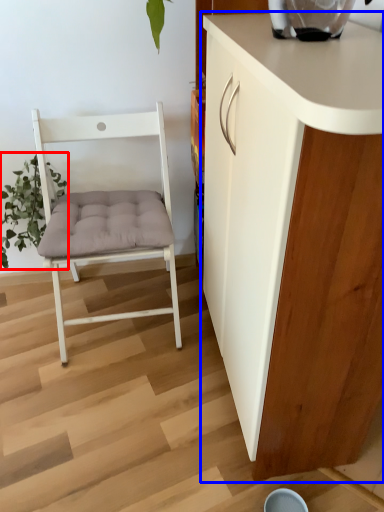
Question: Which of the following is the closest to the observer, plant (highlighted by a red box) or cabinetry (highlighted by a blue box)?

Choices:
 (A) plant
 (B) cabinetry

Answer: (B)